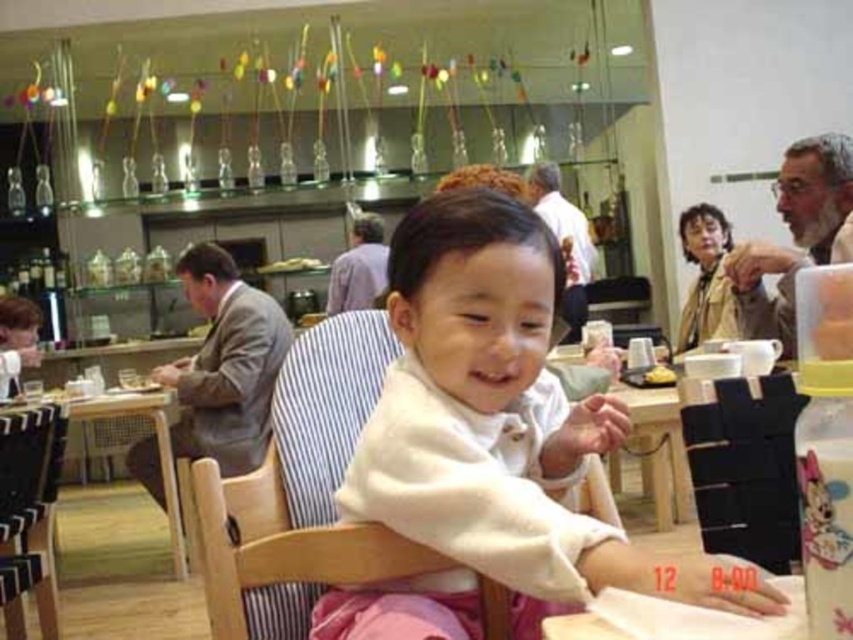
Who is more distant from viewer, (519,305) or (360,236)?

Point (360,236)

Does white soft baby at center have a greater height compared to striped shirt at center?

No, white soft baby at center is not taller than striped shirt at center.

Which is in front, point (466, 378) or point (357, 248)?

Positioned in front is point (466, 378).

Identify the location of white soft baby at center. This screenshot has height=640, width=853. (491, 442).

From the picture: Can you confirm if wooden highchair at center is taller than light brown suit at left?

No, wooden highchair at center is not taller than light brown suit at left.

Does wooden highchair at center have a lesser height compared to light brown suit at left?

Correct, wooden highchair at center is not as tall as light brown suit at left.

Is point (502, 604) closer to viewer compared to point (218, 420)?

That is True.

At what (x,y) coordinates should I click in order to perform the action: click on wooden highchair at center. Please return your answer as a coordinate pair (x, y). This screenshot has width=853, height=640. Looking at the image, I should click on (299, 492).

Does light brown suit at left have a greater width compared to white shirt at upper center?

Yes, light brown suit at left is wider than white shirt at upper center.

Between light brown suit at left and white shirt at upper center, which one has more height?

light brown suit at left

Does point (257, 333) come farther from viewer compared to point (543, 204)?

No, (257, 333) is in front of (543, 204).

Identify the location of light brown suit at left. This screenshot has width=853, height=640. point(225,364).